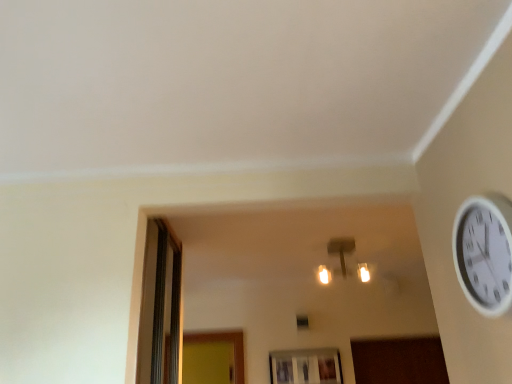
Question: Does matte gold light fixture at center have a lesser width compared to white plastic wall clock at upper right?

Choices:
 (A) yes
 (B) no

Answer: (B)

Question: Is matte gold light fixture at center looking in the opposite direction of white plastic wall clock at upper right?

Choices:
 (A) no
 (B) yes

Answer: (A)

Question: From the image's perspective, is matte gold light fixture at center below white plastic wall clock at upper right?

Choices:
 (A) yes
 (B) no

Answer: (A)

Question: Can you confirm if matte gold light fixture at center is shorter than white plastic wall clock at upper right?

Choices:
 (A) yes
 (B) no

Answer: (A)

Question: Does matte gold light fixture at center have a larger size compared to white plastic wall clock at upper right?

Choices:
 (A) no
 (B) yes

Answer: (B)

Question: Is matte gold light fixture at center to the left of white plastic wall clock at upper right from the viewer's perspective?

Choices:
 (A) yes
 (B) no

Answer: (A)

Question: Can we say transparent glass window at lower center lies outside matte gold light fixture at center?

Choices:
 (A) yes
 (B) no

Answer: (A)

Question: Is transparent glass window at lower center thinner than matte gold light fixture at center?

Choices:
 (A) yes
 (B) no

Answer: (A)

Question: Does transparent glass window at lower center lie behind matte gold light fixture at center?

Choices:
 (A) yes
 (B) no

Answer: (A)

Question: Can matte gold light fixture at center be found inside transparent glass window at lower center?

Choices:
 (A) no
 (B) yes

Answer: (A)

Question: Considering the relative sizes of transparent glass window at lower center and matte gold light fixture at center in the image provided, is transparent glass window at lower center taller than matte gold light fixture at center?

Choices:
 (A) no
 (B) yes

Answer: (B)

Question: From a real-world perspective, does transparent glass window at lower center stand above matte gold light fixture at center?

Choices:
 (A) no
 (B) yes

Answer: (A)

Question: Does transparent glass window at lower center turn towards white plastic wall clock at upper right?

Choices:
 (A) yes
 (B) no

Answer: (A)